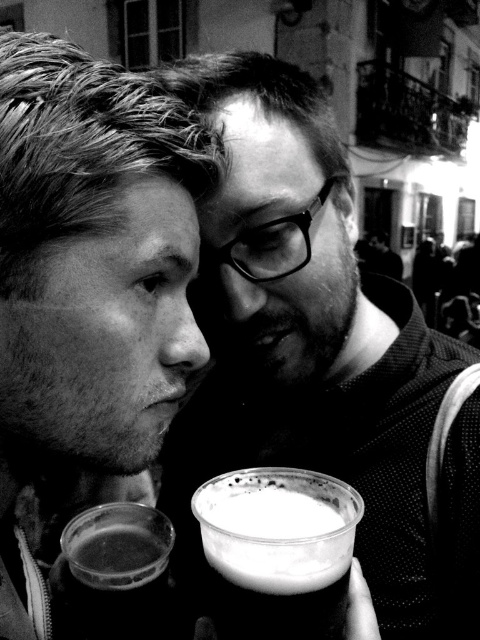
You are a photographer trying to capture a candid shot of two people talking. You want to ensure that both faces are in focus. The camera you are using has a depth of field that can cover 16 inches. Given that the smooth skin face at left and the other person are 16.70 inches apart, will the depth of field be sufficient to keep both faces in focus?

The smooth skin face at left and the other person are 16.70 inches apart. Since the camera has a depth of field of 16 inches, which is less than the distance between them, the depth of field will not be sufficient to keep both faces in focus.

You are at a street fair and want to choose between two drinks. You have a matte plastic cup at center and a foamy dark beer at lower center. Which drink is taller?

The matte plastic cup at center is much taller than the foamy dark beer at lower center.